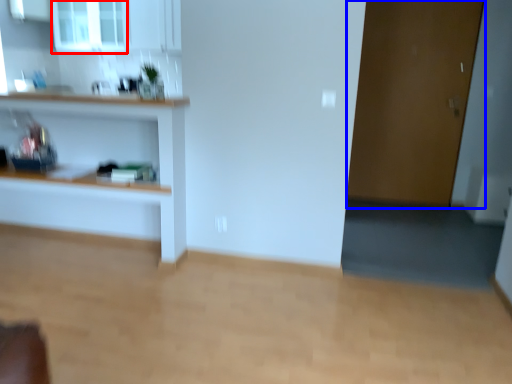
Question: Which of the following is the closest to the observer, window (highlighted by a red box) or door (highlighted by a blue box)?

Choices:
 (A) window
 (B) door

Answer: (B)